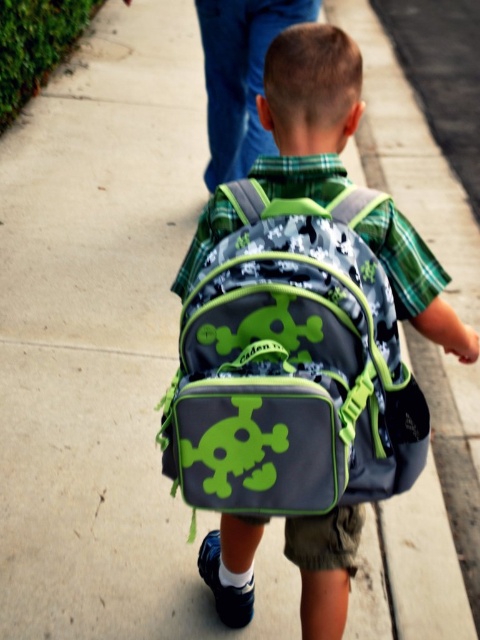
Does point (255, 269) come farther from viewer compared to point (325, 192)?

No, it is not.

At what (x,y) coordinates should I click in order to perform the action: click on matte gray backpack with green accents at center. Please return your answer as a coordinate pair (x, y). The height and width of the screenshot is (640, 480). Looking at the image, I should click on (290, 365).